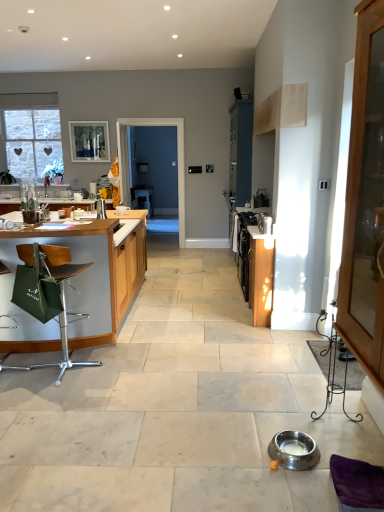
Identify the location of free space that is to the left of wooden cabinet at right, arranged as the first cabinetry when viewed from the back. This screenshot has height=512, width=384. (227, 318).